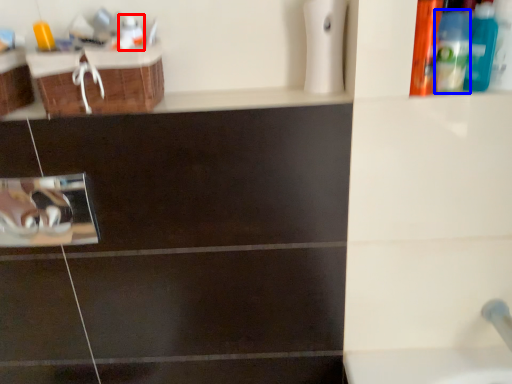
Question: Which object is further to the camera taking this photo, mouthwash (highlighted by a red box) or mouthwash (highlighted by a blue box)?

Choices:
 (A) mouthwash
 (B) mouthwash

Answer: (A)